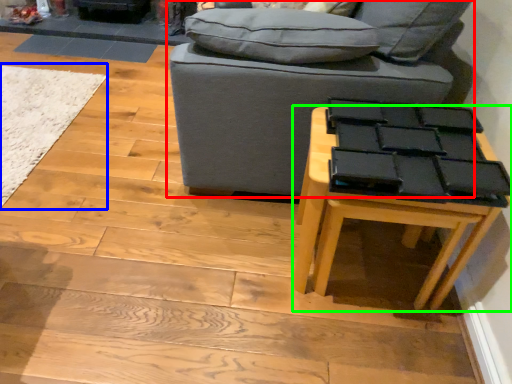
Question: Based on their relative distances, which object is nearer to studio couch (highlighted by a red box)? Choose from mat (highlighted by a blue box) and table (highlighted by a green box).

Choices:
 (A) mat
 (B) table

Answer: (B)